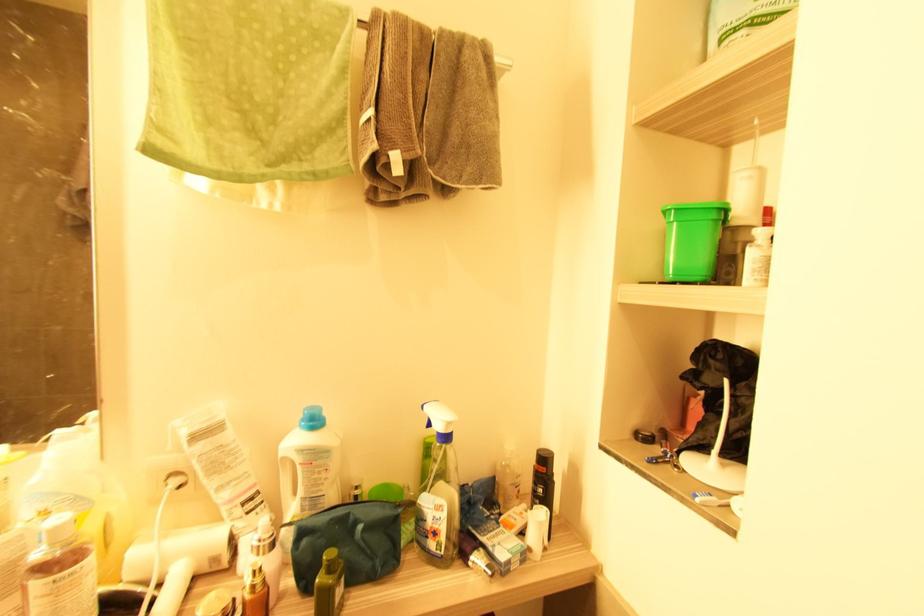
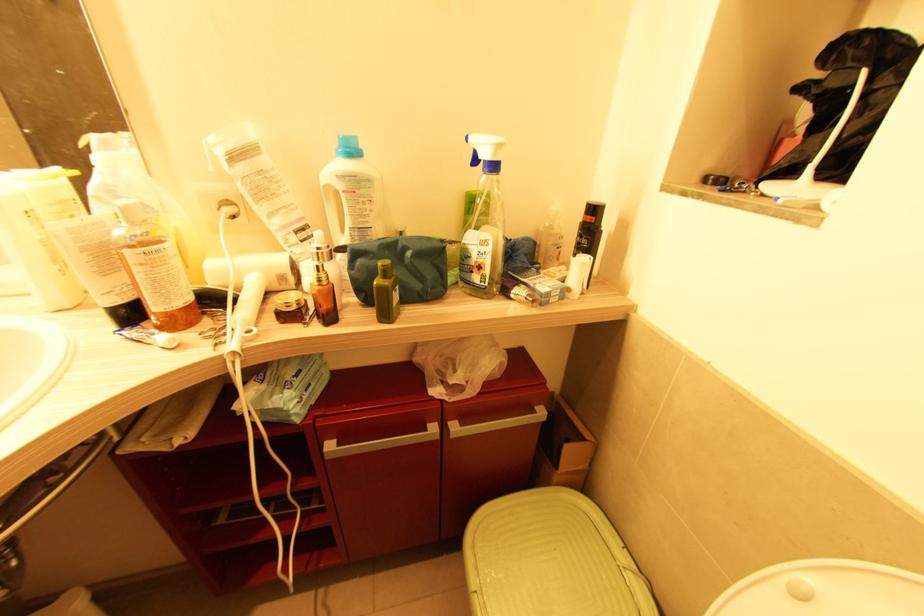
In the second image, find the point that corresponds to (429,539) in the first image.

(473, 273)